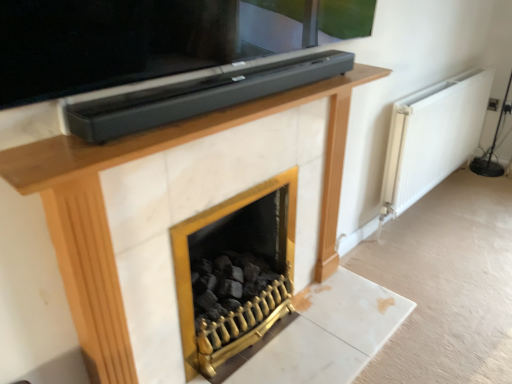
Question: Is point (281, 215) closer or farther from the camera than point (423, 122)?

Choices:
 (A) farther
 (B) closer

Answer: (B)

Question: Considering the positions of gold metallic fireplace at center and white matte radiator at right in the image, is gold metallic fireplace at center wider or thinner than white matte radiator at right?

Choices:
 (A) thin
 (B) wide

Answer: (B)

Question: Considering the relative positions of gold metallic fireplace at center and white matte radiator at right in the image provided, is gold metallic fireplace at center to the left or to the right of white matte radiator at right?

Choices:
 (A) left
 (B) right

Answer: (A)

Question: Is white matte radiator at right in front of or behind gold metallic fireplace at center in the image?

Choices:
 (A) behind
 (B) front

Answer: (A)

Question: From the image's perspective, relative to gold metallic fireplace at center, is white matte radiator at right above or below?

Choices:
 (A) below
 (B) above

Answer: (B)

Question: Is white matte radiator at right wider or thinner than gold metallic fireplace at center?

Choices:
 (A) thin
 (B) wide

Answer: (A)

Question: Is white matte radiator at right to the left or to the right of gold metallic fireplace at center in the image?

Choices:
 (A) left
 (B) right

Answer: (B)